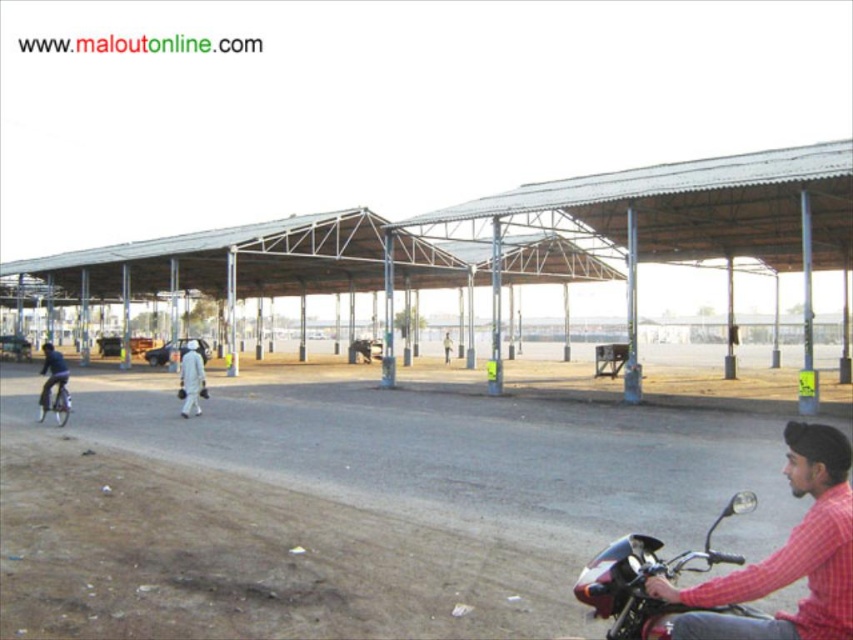
You are standing at the point marked by the coordinates point (772,627). You want to move towards the motorcycle. Is the motorcycle in front of or behind you?

The motorcycle is behind you because the point (772,627) is 10.90 feet from the viewer, meaning the viewer is facing away from the motorcycle.

You are standing at the entrance of the structure and want to greet both the red checkered shirt at lower right and the white matte person at center. Which person should you approach first if you want to minimize the total distance walked?

The red checkered shirt at lower right is closer to you than the white matte person at center, so you should approach the red checkered shirt at lower right first to minimize the total distance walked.

You are standing at the origin point of the coordinate system where the motorcycle is located. The red checkered shirt at lower right is at point (787, 556). What direction should you walk to reach the red checkered shirt at lower right?

To reach the red checkpered shirt at lower right, you should walk in the direction of the point (787, 556) from the motorcycle. Since the coordinate system is not specified, but assuming standard Cartesian coordinates where x increases to the right and y increases downward, the point (787, 556) would be to the lower right of the motorcycle. Therefore, you should walk towards the lower right direction from the motorcycle to reach the red checkered shirt at lower right.